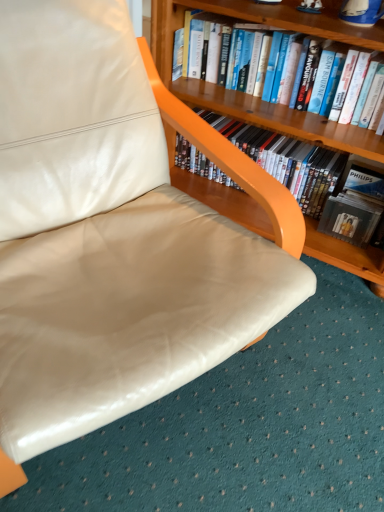
Question: Is wooden bookcase at upper right turned away from matte black dvd case at upper right, marked as the second book in a top-to-bottom arrangement?

Choices:
 (A) yes
 (B) no

Answer: (A)

Question: From the image's perspective, is wooden bookcase at upper right on top of matte black dvd case at upper right, which is the first book from bottom to top?

Choices:
 (A) yes
 (B) no

Answer: (A)

Question: Is wooden bookcase at upper right positioned beyond the bounds of matte black dvd case at upper right, marked as the second book in a top-to-bottom arrangement?

Choices:
 (A) yes
 (B) no

Answer: (A)

Question: Is wooden bookcase at upper right at the left side of matte black dvd case at upper right, which is the first book from bottom to top?

Choices:
 (A) no
 (B) yes

Answer: (B)

Question: Is wooden bookcase at upper right taller than matte black dvd case at upper right, marked as the second book in a top-to-bottom arrangement?

Choices:
 (A) yes
 (B) no

Answer: (A)

Question: Does wooden bookcase at upper right have a lesser height compared to matte black dvd case at upper right, marked as the second book in a top-to-bottom arrangement?

Choices:
 (A) yes
 (B) no

Answer: (B)

Question: Can you confirm if wooden bookcase at upper right is smaller than hardcover book at upper center, the second book in the bottom-to-top sequence?

Choices:
 (A) yes
 (B) no

Answer: (B)

Question: Considering the relative positions of wooden bookcase at upper right and hardcover book at upper center, the first book when ordered from top to bottom, in the image provided, is wooden bookcase at upper right to the left of hardcover book at upper center, the first book when ordered from top to bottom, from the viewer's perspective?

Choices:
 (A) yes
 (B) no

Answer: (B)

Question: From the image's perspective, is wooden bookcase at upper right on hardcover book at upper center, the first book when ordered from top to bottom?

Choices:
 (A) no
 (B) yes

Answer: (A)

Question: From a real-world perspective, is wooden bookcase at upper right located beneath hardcover book at upper center, the first book when ordered from top to bottom?

Choices:
 (A) yes
 (B) no

Answer: (A)

Question: Is the position of wooden bookcase at upper right less distant than that of hardcover book at upper center, the first book when ordered from top to bottom?

Choices:
 (A) yes
 (B) no

Answer: (A)

Question: Is wooden bookcase at upper right thinner than hardcover book at upper center, the first book when ordered from top to bottom?

Choices:
 (A) no
 (B) yes

Answer: (A)

Question: Is hardcover book at upper center, the second book in the bottom-to-top sequence, to the left of matte black dvd case at upper right, marked as the second book in a top-to-bottom arrangement, from the viewer's perspective?

Choices:
 (A) no
 (B) yes

Answer: (B)